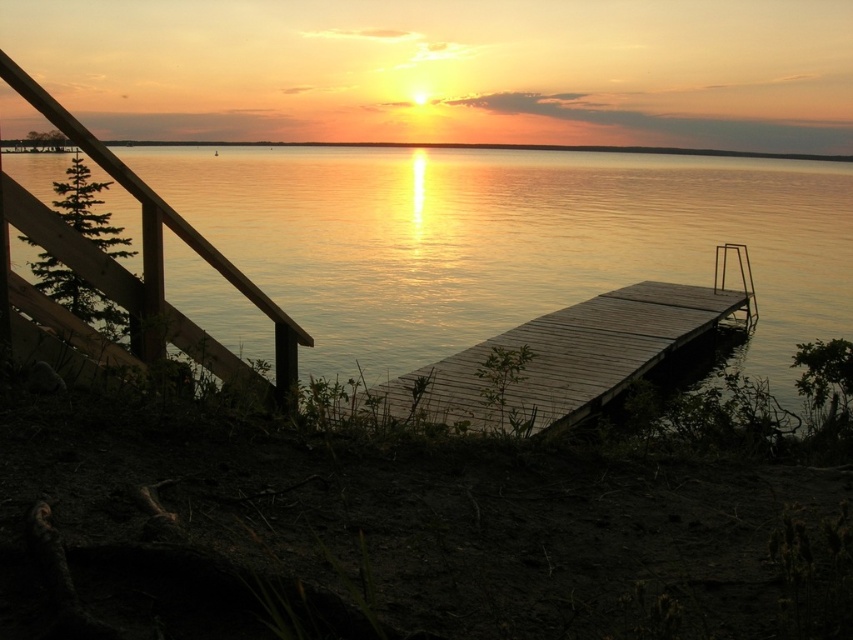
You are standing at the edge of the lakeside and want to reach the glistening water at center. Based on the coordinates provided, in which direction should you move relative to your current position?

The glistening water at center is located at coordinates point (508,241), so you should move towards the center of the scene to reach it.

You are standing at point A located at coordinates point A at (566,410). You want to reach point B, which is 12.55 meters away from point A. Considering the scene described, can you safely walk from point A to point B without getting your feet wet?

The distance between point A at (566,410) and point B is 12.55 meters. Since the scene describes a wooden dock extending into the lake, it is possible that the dock spans this distance. Therefore, you can safely walk from point A to point B along the dock without getting your feet wet.